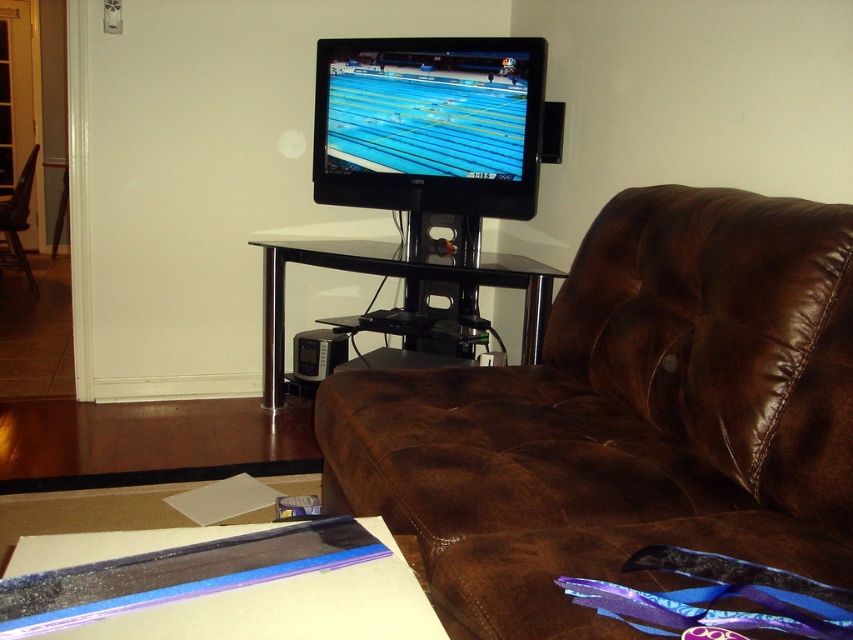
You are trying to place a new lamp on the translucent plastic flat at lower left. However, you need to ensure it won t block the view of the black glass entertainment center at center. Based on their positions, is this possible?

The translucent plastic flat at lower left is to the left of the black glass entertainment center at center. Since the plastic flat is positioned to the left, placing the lamp there would not block the view of the entertainment center as they are aligned horizontally.